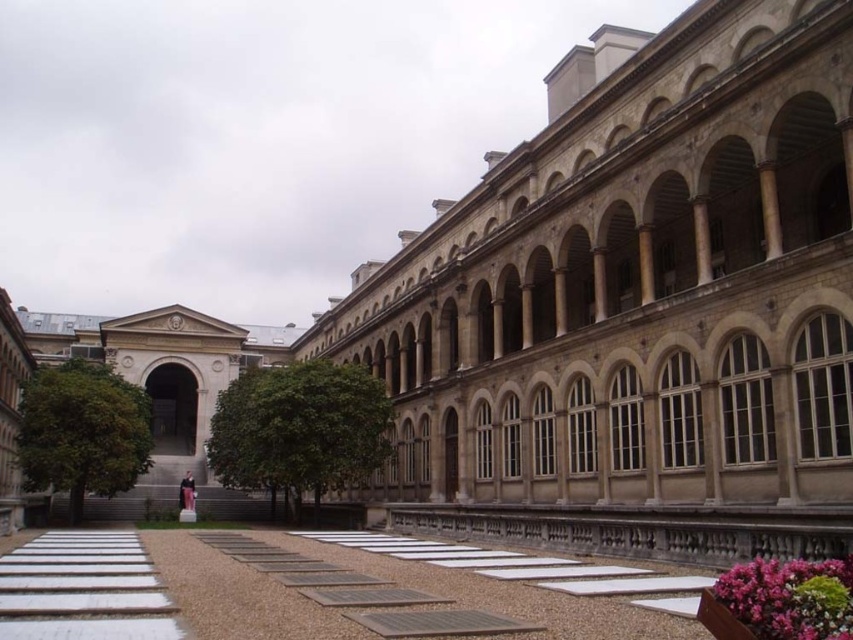
You are standing in the courtyard and want to take a photo of the beige stone palace at center and the pink textured flowers at lower right together in the frame. Which direction should you face to include both in your photo?

You should face towards the right side of the beige stone palace at center because it is to the left of the pink textured flowers at lower right, so facing right would allow both to be in the frame.

You are standing in the courtyard and want to reach the point marked at coordinates point (573,74). Given that you can walk 3 feet per second, how long will it take you to reach that point?

The point (573,74) is 240.08 feet away from the camera. At a walking speed of 3 feet per second, it would take approximately 80 seconds to reach the point.